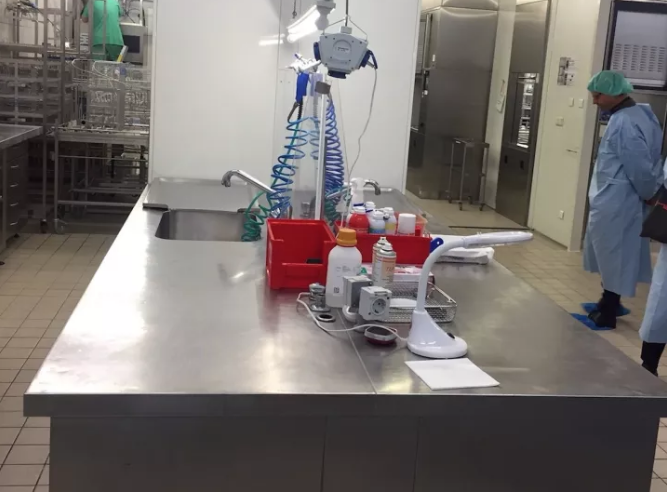
The height and width of the screenshot is (492, 667). Identify the location of sink. (219, 221).